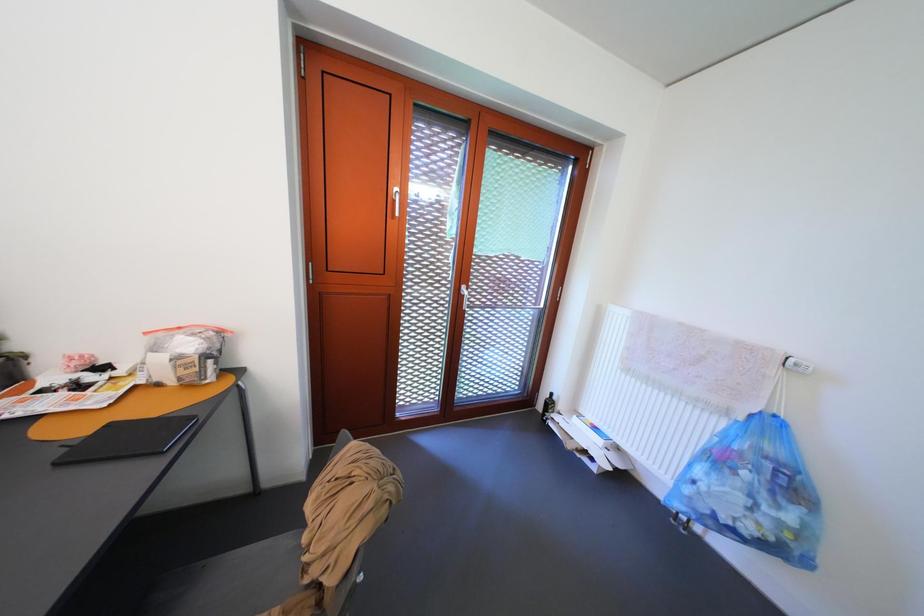
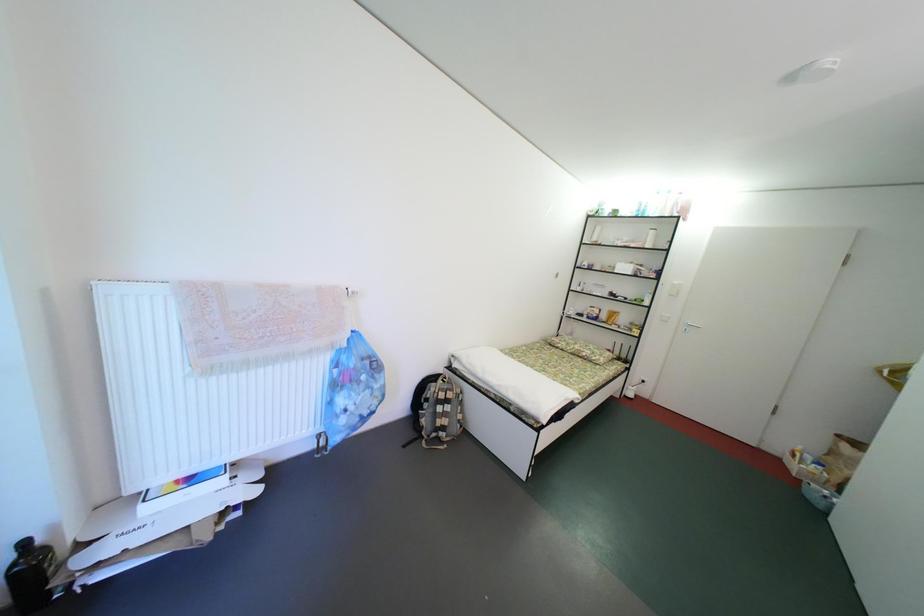
How did the camera likely rotate?

The camera's rotation is toward right-down.